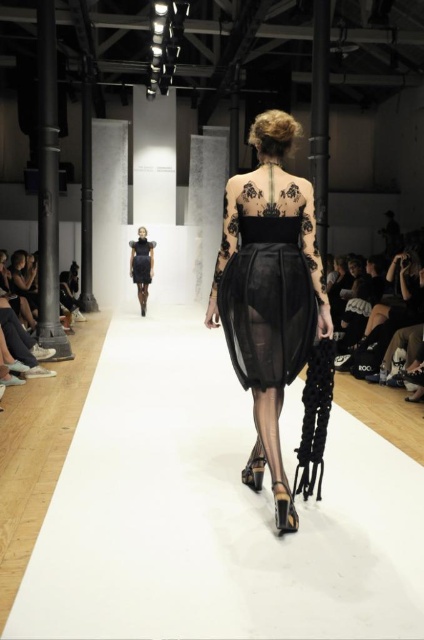
In the scene shown: Is sheer black fabric dress at center below black satin dress at center?

Indeed, sheer black fabric dress at center is positioned under black satin dress at center.

Is sheer black fabric dress at center closer to the viewer compared to black satin dress at center?

Yes, sheer black fabric dress at center is in front of black satin dress at center.

Locate an element on the screen. This screenshot has height=640, width=424. sheer black fabric dress at center is located at coordinates (272, 296).

Locate an element on the screen. sheer black fabric dress at center is located at coordinates (272, 296).

Between black sheer dress at center and black satin dress at center, which one is positioned higher?

black satin dress at center is higher up.

Which is behind, point (247, 324) or point (150, 244)?

The point (150, 244) is more distant.

Who is more forward, (292,268) or (130,244)?

Point (292,268) is in front.

Where is `black sheer dress at center`? black sheer dress at center is located at coordinates (267, 276).

The height and width of the screenshot is (640, 424). I want to click on matte black dress at center, so click(142, 266).

Can you confirm if matte black dress at center is positioned to the left of black satin dress at center?

Incorrect, matte black dress at center is not on the left side of black satin dress at center.

I want to click on matte black dress at center, so click(142, 266).

This screenshot has height=640, width=424. I want to click on matte black dress at center, so pos(142,266).